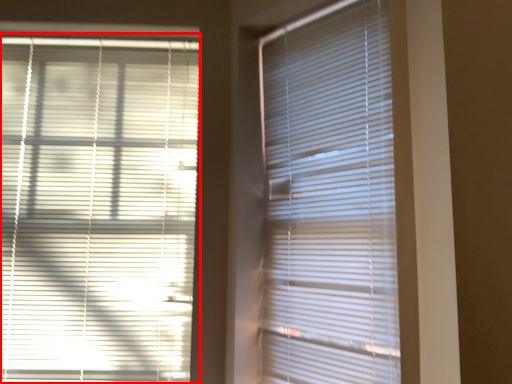
Question: From the image's perspective, what is the correct spatial relationship of window blind (annotated by the red box) in relation to window blind?

Choices:
 (A) below
 (B) above

Answer: (A)